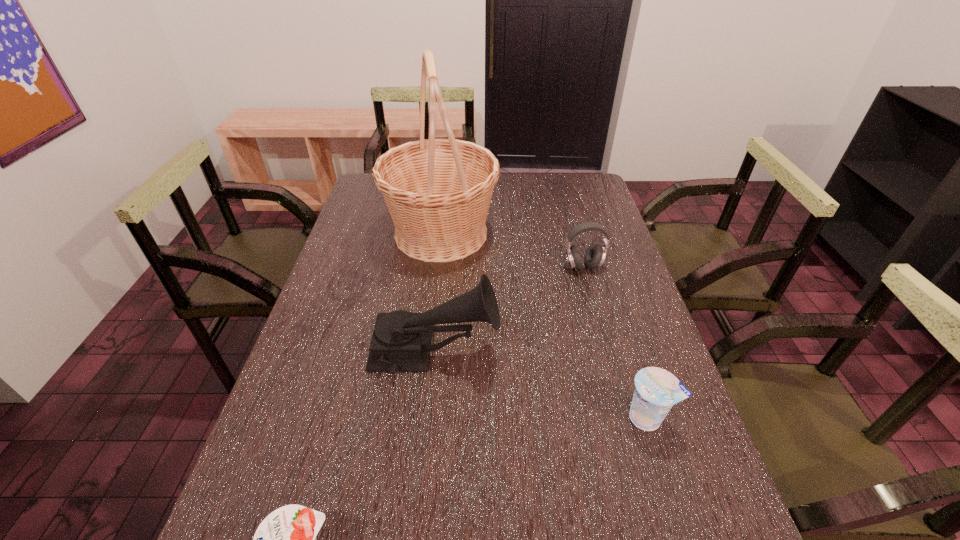
This screenshot has width=960, height=540. I want to click on basket, so click(x=438, y=191).

The width and height of the screenshot is (960, 540). In order to click on the third nearest object in this screenshot , I will do `click(401, 341)`.

You are a GUI agent. You are given a task and a screenshot of the screen. Output one action in this format:
    pyautogui.click(x=<x>, y=<y>)
    Task: Click on the phonograph_record
    The image size is (960, 540).
    Given the screenshot: What is the action you would take?
    pyautogui.click(x=401, y=341)

Locate an element on the screen. This screenshot has height=540, width=960. the third tallest object is located at coordinates (595, 254).

Identify the location of the farther yogurt. (657, 390).

Where is `the second nearest object`? This screenshot has width=960, height=540. the second nearest object is located at coordinates (657, 390).

Find the location of a particular element. free space located on the left of the basket is located at coordinates (367, 233).

Identify the location of vacant space positioned from the horn of the third farthest object. The image size is (960, 540). (565, 352).

Identify the location of vacant space located on the ear cups of the third tallest object. The image size is (960, 540). (590, 295).

Find the location of a particular element. This screenshot has height=540, width=960. free space located 0.180m on the left of the right yogurt is located at coordinates (542, 418).